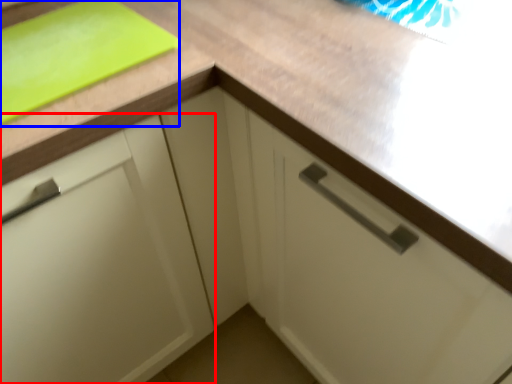
Question: Which of the following is the farthest to the observer, cabinetry (highlighted by a red box) or cutting board (highlighted by a blue box)?

Choices:
 (A) cabinetry
 (B) cutting board

Answer: (B)